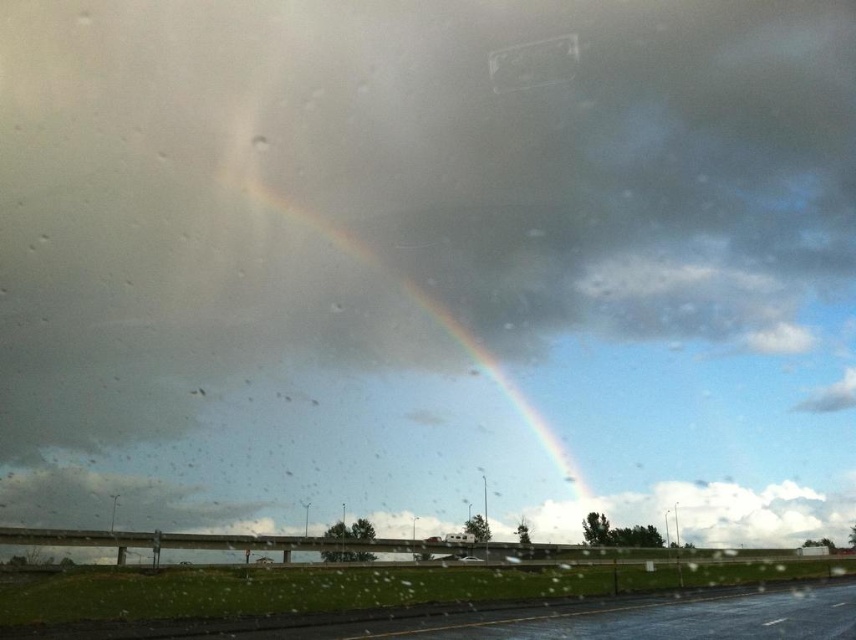
Question: Which point appears farthest from the camera in this image?

Choices:
 (A) (535, 77)
 (B) (135, 624)

Answer: (A)

Question: Can you confirm if rainbow at upper center is smaller than transparent plastic car window at upper center?

Choices:
 (A) yes
 (B) no

Answer: (B)

Question: Can you confirm if glossy asphalt highway at lower center is bigger than white glossy car at center?

Choices:
 (A) yes
 (B) no

Answer: (A)

Question: Which object is positioned farthest from the transparent plastic car window at upper center?

Choices:
 (A) glossy asphalt highway at lower center
 (B) rainbow at upper center

Answer: (A)

Question: Which is nearer to the rainbow at upper center?

Choices:
 (A) white glossy car at center
 (B) glossy asphalt highway at lower center
 (C) transparent plastic car window at upper center

Answer: (C)

Question: Can you confirm if glossy asphalt highway at lower center is positioned below transparent plastic car window at upper center?

Choices:
 (A) yes
 (B) no

Answer: (A)